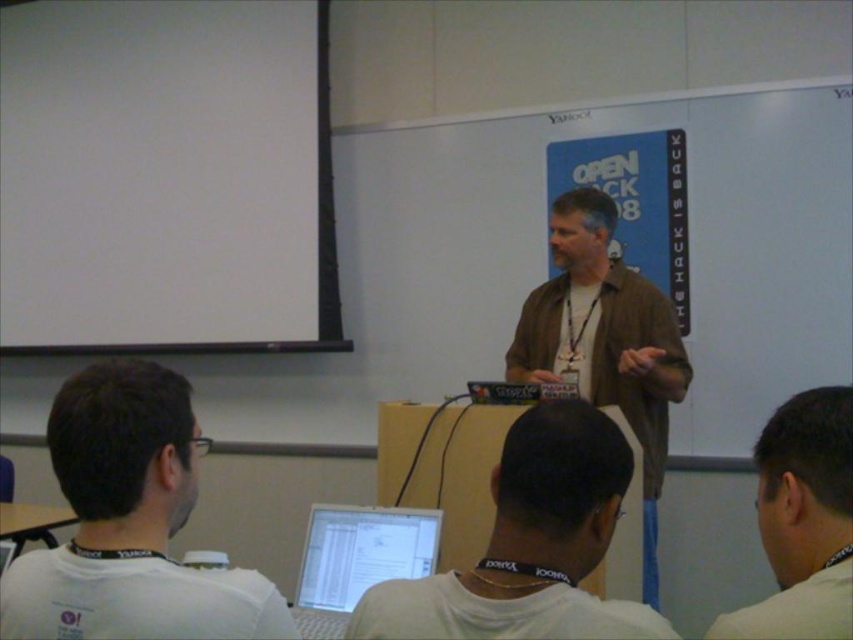
Is white matte projection screen at upper left wider than white lanyard at upper right?

Indeed, white matte projection screen at upper left has a greater width compared to white lanyard at upper right.

Is white matte projection screen at upper left in front of white lanyard at upper right?

No.

The image size is (853, 640). I want to click on white matte projection screen at upper left, so click(x=166, y=177).

Where is `white matte projection screen at upper left`? This screenshot has height=640, width=853. white matte projection screen at upper left is located at coordinates (166, 177).

Who is lower down, white glossy laptop at center or brown casual shirt at center?

white glossy laptop at center

Is white glossy laptop at center positioned before brown casual shirt at center?

Yes, white glossy laptop at center is closer to the viewer.

Is point (549, 592) positioned after point (648, 458)?

No, it is in front of (648, 458).

The image size is (853, 640). I want to click on white glossy laptop at center, so click(x=531, y=545).

Looking at this image, can you confirm if brown casual shirt at center is positioned above white lanyard at upper right?

Actually, brown casual shirt at center is below white lanyard at upper right.

Between brown casual shirt at center and white lanyard at upper right, which one is positioned lower?

Positioned lower is brown casual shirt at center.

The image size is (853, 640). I want to click on brown casual shirt at center, so click(x=605, y=340).